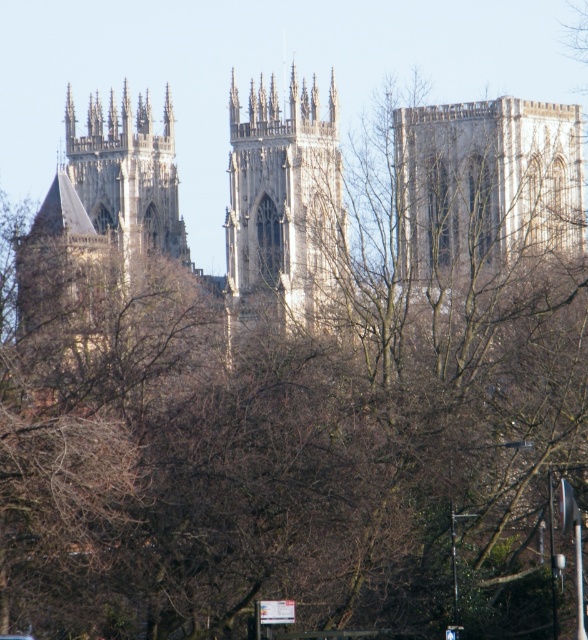
Question: Which object appears closest to the camera in this image?

Choices:
 (A) stone gothic tower at center
 (B) stone gothic tower at left

Answer: (A)

Question: Which point appears farthest from the camera in this image?

Choices:
 (A) (65, 205)
 (B) (459, 241)
 (C) (119, 212)

Answer: (A)

Question: Can you confirm if stone tower at upper right is positioned to the left of stone gothic tower at left?

Choices:
 (A) yes
 (B) no

Answer: (B)

Question: Which of the following is the farthest from the observer?

Choices:
 (A) stone tower at upper right
 (B) stone gothic tower at left
 (C) stone gothic tower at center

Answer: (B)

Question: Does stone gothic tower at left appear under stone steeple at left?

Choices:
 (A) yes
 (B) no

Answer: (B)

Question: Does stone gothic tower at left appear on the left side of stone steeple at left?

Choices:
 (A) yes
 (B) no

Answer: (B)